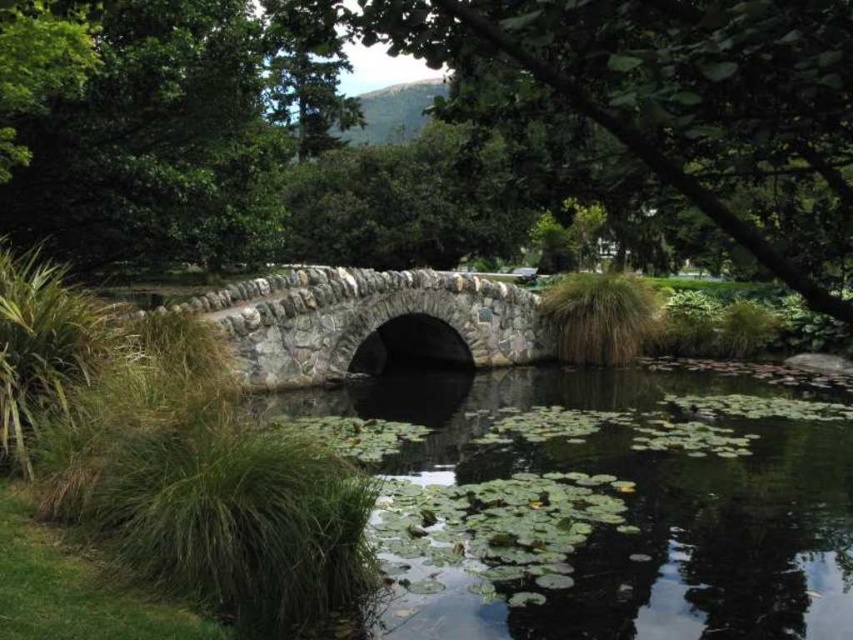
What do you see at coordinates (601, 504) in the screenshot? This screenshot has height=640, width=853. I see `green leafy water at center` at bounding box center [601, 504].

The image size is (853, 640). In order to click on green leafy water at center in this screenshot , I will do tap(601, 504).